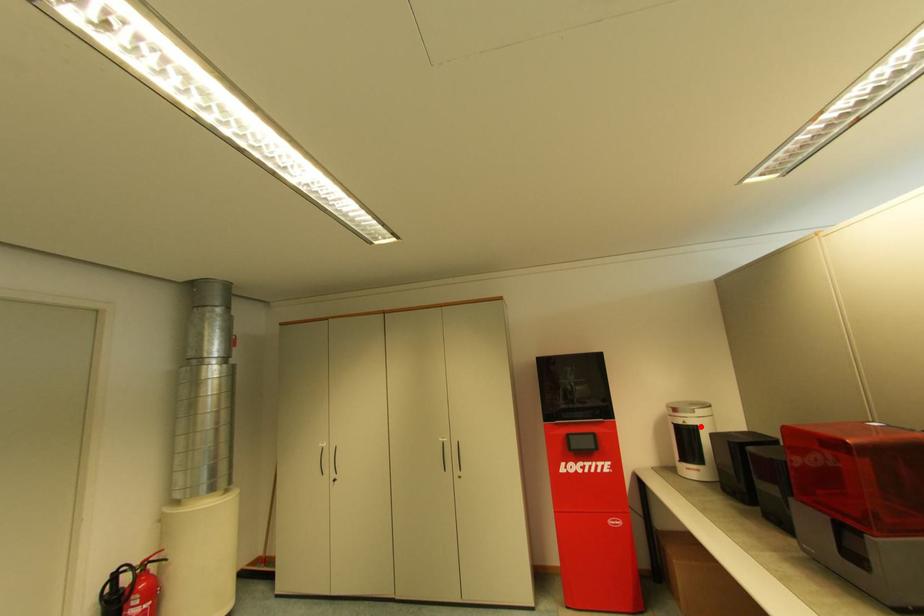
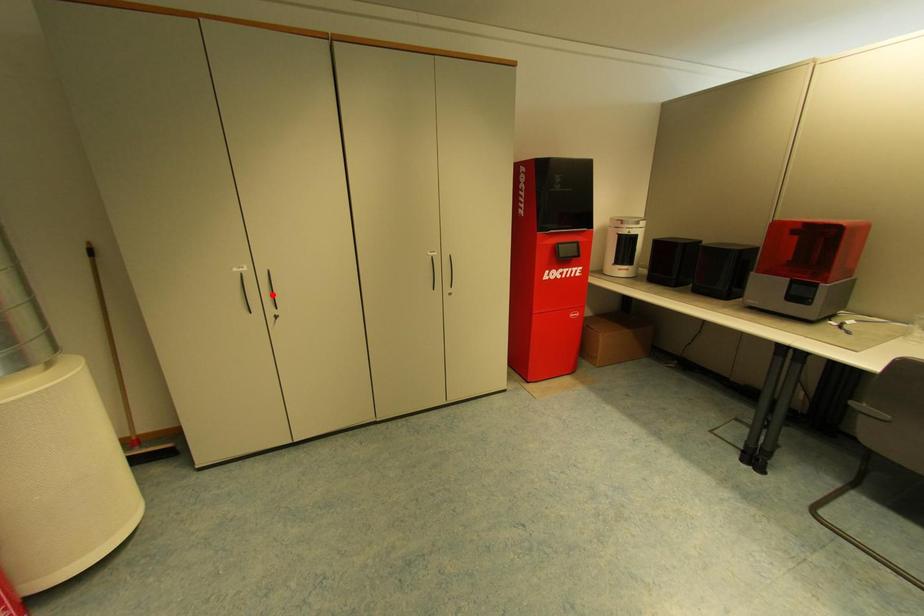
I am providing you with two images of the same scene from different viewpoints. A red point is marked on the first image and another point is marked on the second image. Is the marked point in image1 the same physical position as the marked point in image2?

No